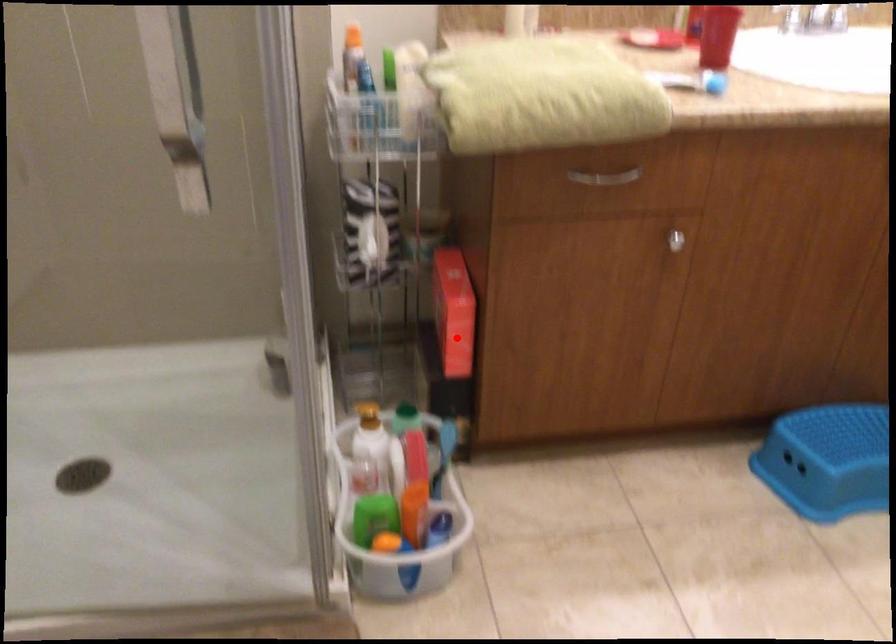
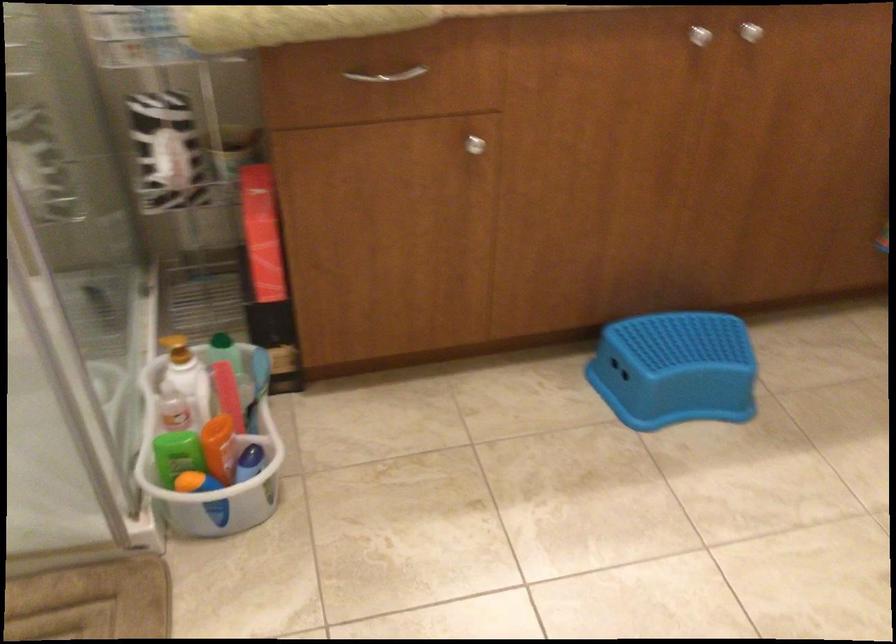
Find the pixel in the second image that matches the highlighted location in the first image.

(264, 263)